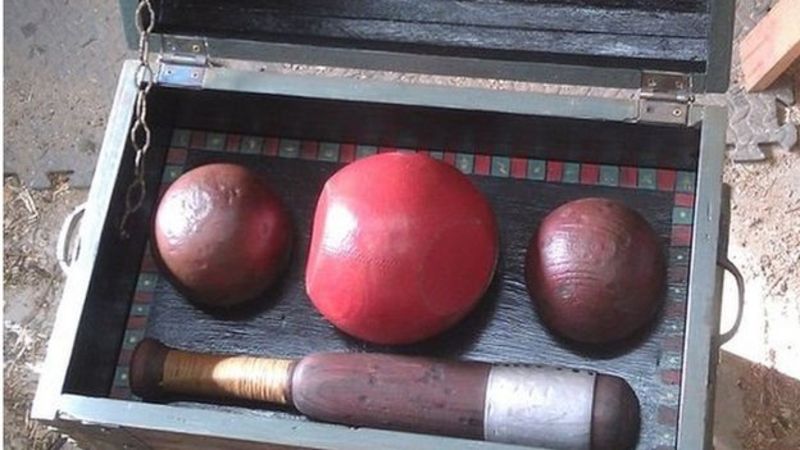
Where is `handle`? This screenshot has width=800, height=450. handle is located at coordinates (66, 235), (742, 297).